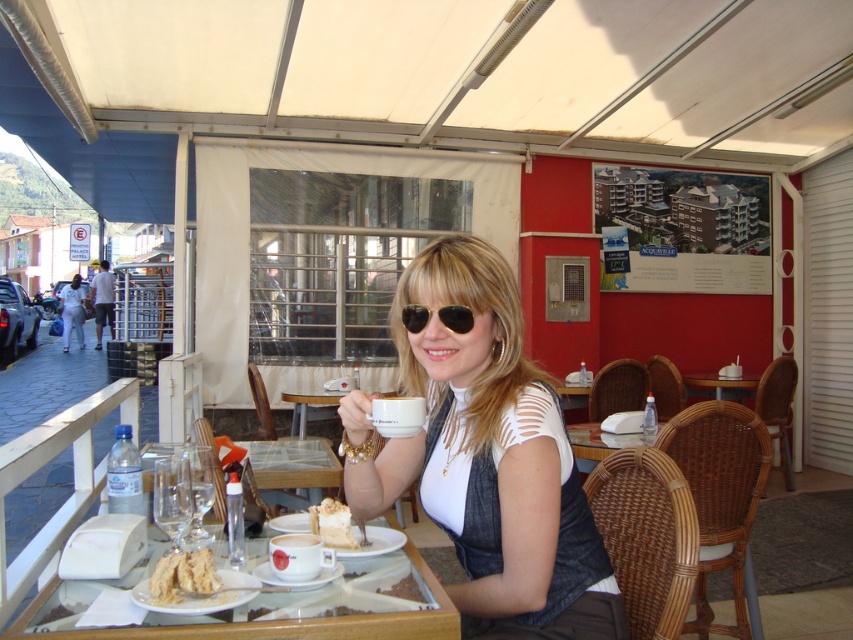
You are a photographer trying to capture the woman at the outdoor cafe. You want to ensure the white matte shirt at center is in focus. Where should you aim your camera lens?

The white matte shirt at center is located at point 0.717 on the x axis and 0.572 on the y axis, so aim your camera lens at those coordinates to ensure it is in focus.

You are a photographer trying to capture the white matte shirt at center and the wooden table at center in a single shot. Which object should you focus on first if you want to ensure both are in focus?

You should focus on the wooden table at center first because the white matte shirt at center is closer to the viewer. By focusing on the farther object, the depth of field will naturally include the closer object in focus as well.